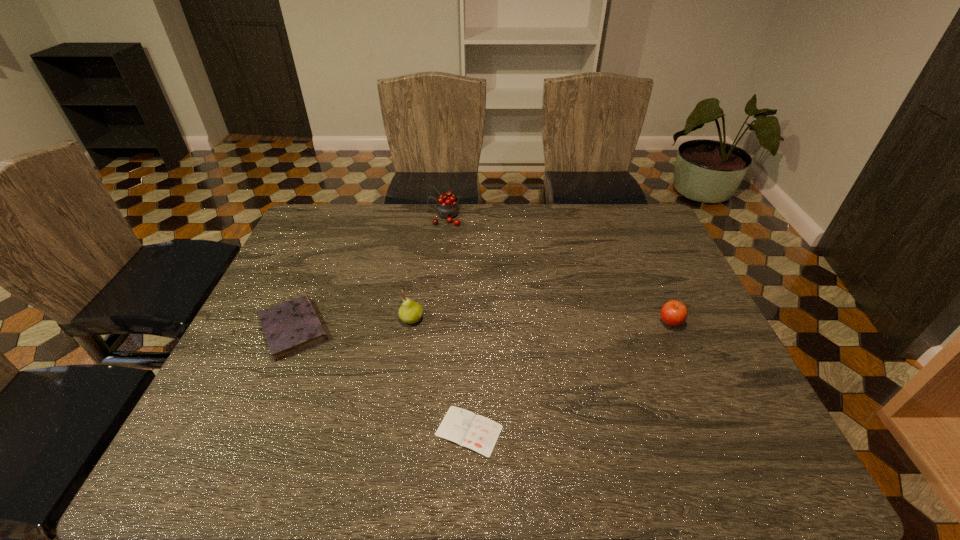
What are the coordinates of `free space between the right diary and the apple` in the screenshot? It's located at (570, 376).

Identify the location of free spot between the nearest object and the third tallest object. (570, 376).

Identify the location of vacant space that is in between the pear and the taller diary. The image size is (960, 540). (352, 324).

Find the location of a particular element. vacant space that's between the third shortest object and the farthest object is located at coordinates (558, 269).

Where is `object identified as the third closest to the farthest object`? This screenshot has height=540, width=960. object identified as the third closest to the farthest object is located at coordinates (674, 313).

Identify the location of the fourth closest object to the cherry. (478, 433).

Find the location of a particular element. free region that satisfies the following two spatial constraints: 1. on the front side of the pear; 2. on the left side of the nearest object is located at coordinates (394, 431).